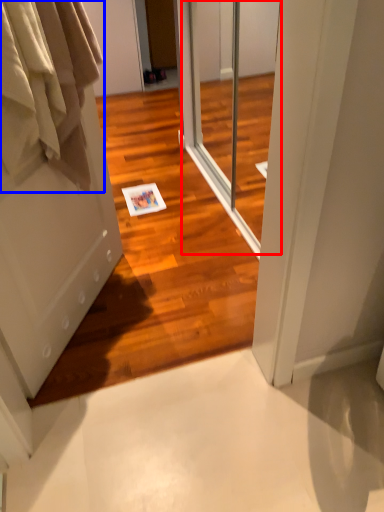
Question: Among these objects, which one is nearest to the camera, screen door (highlighted by a red box) or clothing (highlighted by a blue box)?

Choices:
 (A) screen door
 (B) clothing

Answer: (B)